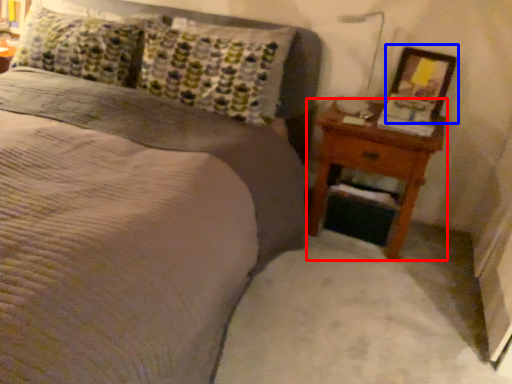
Question: Which point is closer to the camera, nightstand (highlighted by a red box) or picture frame (highlighted by a blue box)?

Choices:
 (A) nightstand
 (B) picture frame

Answer: (A)